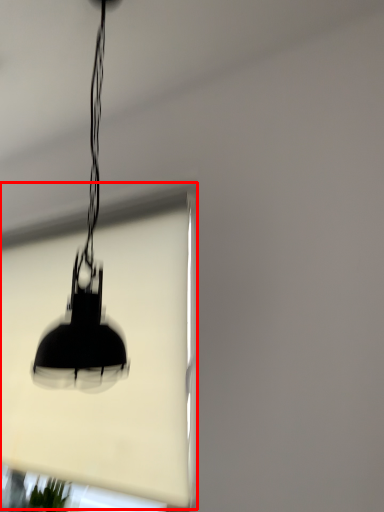
Question: From the image's perspective, what is the correct spatial positioning of window screen (annotated by the red box) in reference to lamp?

Choices:
 (A) below
 (B) above

Answer: (A)